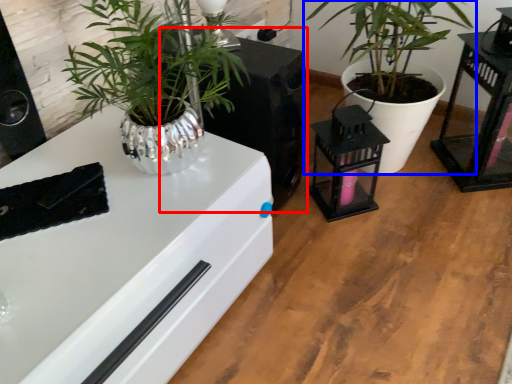
Question: Which object appears farthest to the camera in this image, appliance (highlighted by a red box) or houseplant (highlighted by a blue box)?

Choices:
 (A) appliance
 (B) houseplant

Answer: (A)